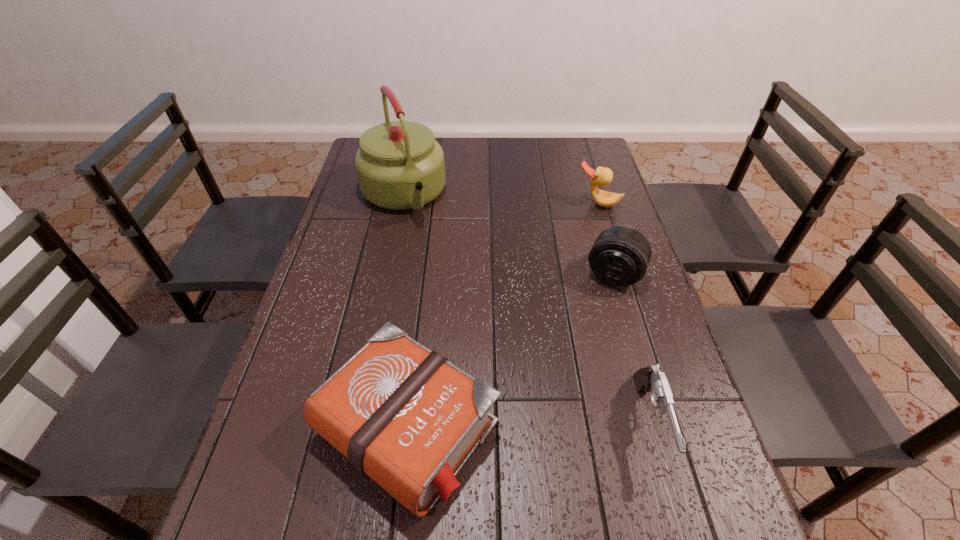
Locate which object is the fourth closest to the Bible. Please provide its 2D coordinates. Your answer should be formatted as a tuple, i.e. [(x, y)], where the tuple contains the x and y coordinates of a point satisfying the conditions above.

[(602, 176)]

At what (x,y) coordinates should I click in order to perform the action: click on the third closest object to the Bible. Please return your answer as a coordinate pair (x, y). Looking at the image, I should click on (400, 166).